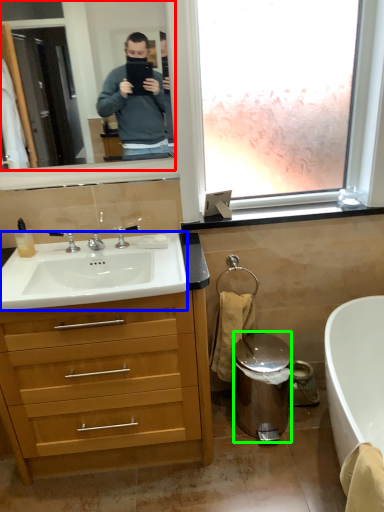
Question: Based on their relative distances, which object is farther from mirror (highlighted by a red box)? Choose from sink (highlighted by a blue box) and trash bin/can (highlighted by a green box).

Choices:
 (A) sink
 (B) trash bin/can

Answer: (B)